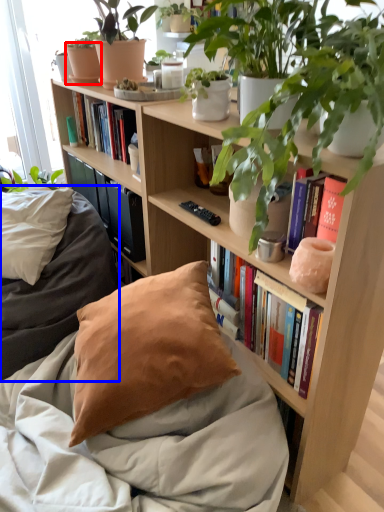
Question: Which point is closer to the camera, flowerpot (highlighted by a red box) or bedding (highlighted by a blue box)?

Choices:
 (A) flowerpot
 (B) bedding

Answer: (B)